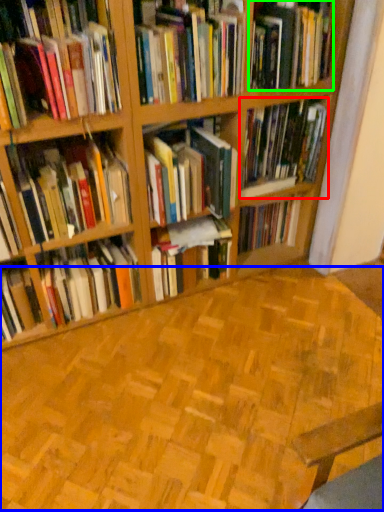
Question: Estimate the real-world distances between objects in this image. Which object is closer to book (highlighted by a red box), hardwood (highlighted by a blue box) or book (highlighted by a green box)?

Choices:
 (A) hardwood
 (B) book

Answer: (B)